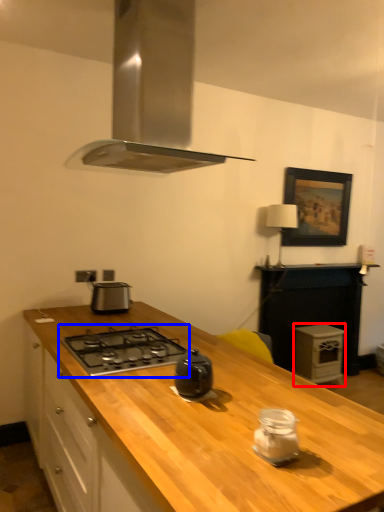
Question: Which object is further to the camera taking this photo, appliance (highlighted by a red box) or gas stove (highlighted by a blue box)?

Choices:
 (A) appliance
 (B) gas stove

Answer: (A)